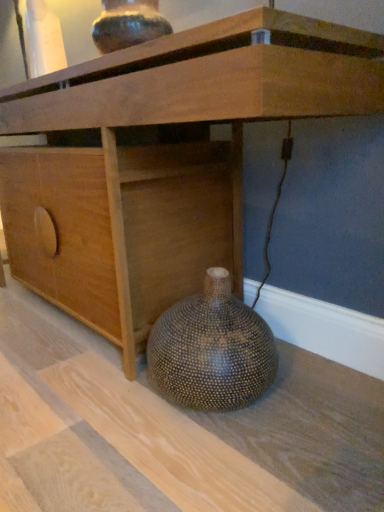
Locate an element on the screen. Image resolution: width=384 pixels, height=512 pixels. free space in front of brown textured vase at lower right, which ranks as the 2th vase in top-to-bottom order is located at coordinates (224, 466).